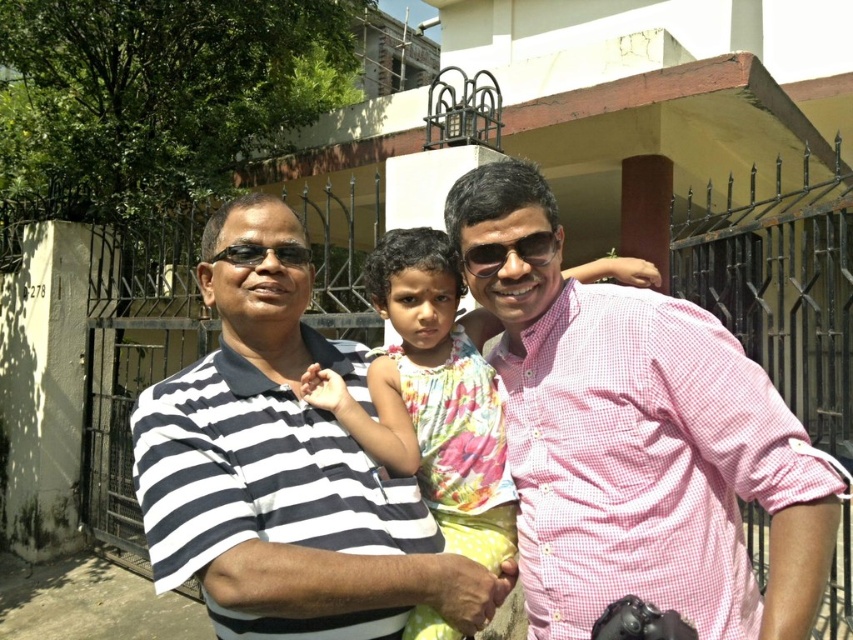
Does pink checkered shirt at center have a larger size compared to striped cotton shirt at center?

Yes, pink checkered shirt at center is bigger than striped cotton shirt at center.

Is pink checkered shirt at center to the right of striped cotton shirt at center from the viewer's perspective?

Indeed, pink checkered shirt at center is positioned on the right side of striped cotton shirt at center.

Is point (608, 413) behind point (251, 346)?

That is False.

The image size is (853, 640). What are the coordinates of `pink checkered shirt at center` in the screenshot? It's located at (637, 442).

Who is lower down, pink checkered shirt at center or black plastic goggles at left?

pink checkered shirt at center

Can you confirm if pink checkered shirt at center is positioned below black plastic goggles at left?

Correct, pink checkered shirt at center is located below black plastic goggles at left.

Does point (572, 499) lie in front of point (227, 253)?

Yes, point (572, 499) is in front of point (227, 253).

The height and width of the screenshot is (640, 853). In order to click on pink checkered shirt at center in this screenshot , I will do `click(637, 442)`.

Is floral fabric dress at center further to the viewer compared to black plastic goggles at left?

That is False.

Can you confirm if floral fabric dress at center is positioned to the left of black plastic goggles at left?

Incorrect, floral fabric dress at center is not on the left side of black plastic goggles at left.

Is point (453, 381) less distant than point (264, 253)?

No.

This screenshot has height=640, width=853. What are the coordinates of `floral fabric dress at center` in the screenshot? It's located at [x=432, y=396].